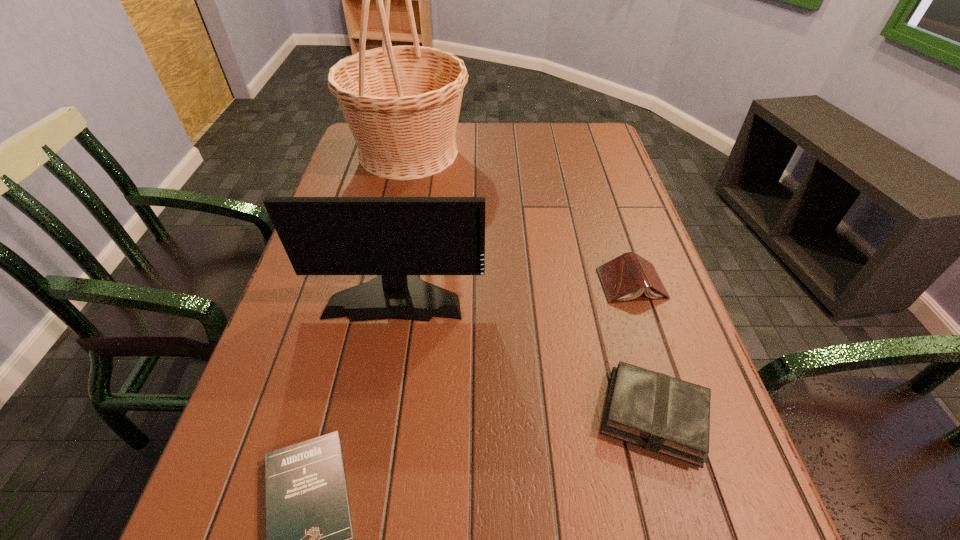
Locate an element on the screen. the tallest object is located at coordinates (402, 103).

At what (x,y) coordinates should I click in order to perform the action: click on the farthest object. Please return your answer as a coordinate pair (x, y). Looking at the image, I should click on (402, 103).

You are a GUI agent. You are given a task and a screenshot of the screen. Output one action in this format:
    pyautogui.click(x=<x>, y=<y>)
    Task: Click on the monitor
    This screenshot has width=960, height=540.
    Given the screenshot: What is the action you would take?
    pyautogui.click(x=396, y=238)

Locate an element on the screen. the farthest book is located at coordinates (626, 277).

Where is `free space located on the front of the basket`? The image size is (960, 540). free space located on the front of the basket is located at coordinates (392, 229).

Identify the location of vacant region located 0.180m on the screen side of the second tallest object. Image resolution: width=960 pixels, height=540 pixels. (376, 401).

Locate an element on the screen. free region located 0.400m on the back of the farthest book is located at coordinates (595, 171).

Image resolution: width=960 pixels, height=540 pixels. In order to click on object situated at the far edge in this screenshot , I will do `click(402, 103)`.

Identify the location of basket located at the left edge. (402, 103).

The height and width of the screenshot is (540, 960). Identify the location of monitor that is at the left edge. (396, 238).